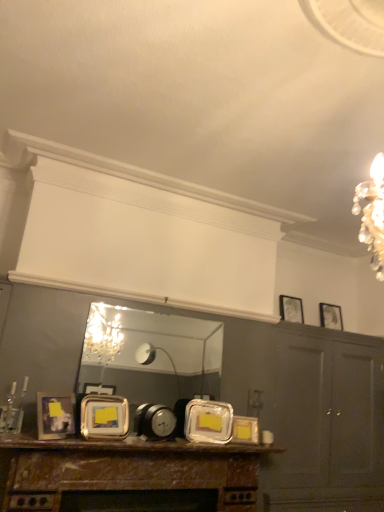
Identify the location of metallic silver alarm clock at center. (154, 421).

Consider the image. Measure the distance between metallic silver frame at center, which is the fourth picture frame in right-to-left order, and camera.

metallic silver frame at center, which is the fourth picture frame in right-to-left order, and camera are 2.44 meters apart from each other.

What are the coordinates of `matte silver picture frame at upper right, the fifth picture frame when ordered from left to right` in the screenshot? It's located at (330, 316).

Image resolution: width=384 pixels, height=512 pixels. What do you see at coordinates (330, 316) in the screenshot?
I see `matte silver picture frame at upper right, the first picture frame in the back-to-front sequence` at bounding box center [330, 316].

At what (x,y) coordinates should I click in order to perform the action: click on matte gray cabinet at right. Please return your answer as a coordinate pair (x, y). Image resolution: width=384 pixels, height=512 pixels. Looking at the image, I should click on (326, 421).

This screenshot has width=384, height=512. What do you see at coordinates (291, 309) in the screenshot? I see `metallic silver picture frame at upper right, which is the fourth picture frame in left-to-right order` at bounding box center [291, 309].

The image size is (384, 512). In order to click on matte silver picture frame at lower left, which ranks as the fifth picture frame in back-to-front order in this screenshot , I will do `click(55, 416)`.

Does point (329, 328) come farther from viewer compared to point (92, 450)?

Yes, it is behind point (92, 450).

What's the angular difference between matte silver picture frame at upper right, the fifth picture frame when ordered from left to right, and rustic wood mantel at lower center's facing directions?

1.96 degrees separate the facing orientations of matte silver picture frame at upper right, the fifth picture frame when ordered from left to right, and rustic wood mantel at lower center.

Considering the sizes of objects matte silver picture frame at upper right, marked as the 1th picture frame in a right-to-left arrangement, and rustic wood mantel at lower center in the image provided, who is taller, matte silver picture frame at upper right, marked as the 1th picture frame in a right-to-left arrangement, or rustic wood mantel at lower center?

rustic wood mantel at lower center is taller.

Between metallic silver picture frame at upper right, the second picture frame in the right-to-left sequence, and metallic silver frame at center, which appears as the fourth picture frame when viewed from the back, which one has larger size?

Bigger between the two is metallic silver frame at center, which appears as the fourth picture frame when viewed from the back.

Is metallic silver picture frame at upper right, which is the 4th picture frame in front-to-back order, spatially inside metallic silver frame at center, which is the fourth picture frame in right-to-left order, or outside of it?

metallic silver picture frame at upper right, which is the 4th picture frame in front-to-back order, is outside metallic silver frame at center, which is the fourth picture frame in right-to-left order.

From a real-world perspective, is metallic silver picture frame at upper right, the second picture frame in the back-to-front sequence, physically above metallic silver frame at center, acting as the 2th picture frame starting from the front?

Indeed, from a real-world perspective, metallic silver picture frame at upper right, the second picture frame in the back-to-front sequence, stands above metallic silver frame at center, acting as the 2th picture frame starting from the front.

Considering the points (291, 313) and (122, 398), which point is in front, point (291, 313) or point (122, 398)?

Point (122, 398)

Considering the relative sizes of metallic silver tray at center and metallic silver alarm clock at center in the image provided, is metallic silver tray at center wider than metallic silver alarm clock at center?

Yes, metallic silver tray at center is wider than metallic silver alarm clock at center.

Find the location of a particular element. The image size is (384, 512). counter top that is below the metallic silver alarm clock at center (from the image's perspective) is located at coordinates (132, 446).

Based on the photo, which is farther, (x=28, y=446) or (x=175, y=418)?

The point (x=175, y=418) is farther from the camera.

Does metallic silver tray at center turn towards metallic silver alarm clock at center?

No, metallic silver tray at center does not turn towards metallic silver alarm clock at center.

Is metallic silver picture frame at upper right, the second picture frame in the back-to-front sequence, oriented away from matte silver picture frame at lower left, the first picture frame viewed from the front?

metallic silver picture frame at upper right, the second picture frame in the back-to-front sequence, does not have its back to matte silver picture frame at lower left, the first picture frame viewed from the front.

At what (x,y) coordinates should I click in order to perform the action: click on the 3rd picture frame to the left when counting from the metallic silver picture frame at upper right, the second picture frame in the right-to-left sequence. Please return your answer as a coordinate pair (x, y). The image size is (384, 512). Looking at the image, I should click on (55, 416).

Can you confirm if metallic silver picture frame at upper right, which is the fourth picture frame in left-to-right order, is shorter than matte silver picture frame at lower left, which appears as the first picture frame when viewed from the left?

Incorrect, the height of metallic silver picture frame at upper right, which is the fourth picture frame in left-to-right order, does not fall short of that of matte silver picture frame at lower left, which appears as the first picture frame when viewed from the left.

In terms of size, does matte gray cabinet at right appear bigger or smaller than metallic reflective mirror at center?

In the image, matte gray cabinet at right appears to be larger than metallic reflective mirror at center.

Does point (348, 433) come in front of point (169, 398)?

That is False.

Does matte gray cabinet at right have a greater height compared to metallic reflective mirror at center?

Yes.

Is matte gray cabinet at right far away from metallic reflective mirror at center?

That's right, there is a large distance between matte gray cabinet at right and metallic reflective mirror at center.

Is matte silver picture frame at lower left, which appears as the first picture frame when viewed from the left, aimed at metallic silver picture frame at upper right, which is the fourth picture frame in left-to-right order?

No, matte silver picture frame at lower left, which appears as the first picture frame when viewed from the left, is not aimed at metallic silver picture frame at upper right, which is the fourth picture frame in left-to-right order.

You are a GUI agent. You are given a task and a screenshot of the screen. Output one action in this format:
    pyautogui.click(x=<x>, y=<y>)
    Task: Click on the 3rd picture frame in front of the metallic silver picture frame at upper right, which is the 4th picture frame in front-to-back order
    
    Given the screenshot: What is the action you would take?
    pyautogui.click(x=55, y=416)

Is point (57, 418) positioned in front of point (302, 318)?

Yes.

Between matte silver picture frame at lower left, which appears as the first picture frame when viewed from the left, and metallic silver picture frame at upper right, which is the 4th picture frame in front-to-back order, which one has less height?

matte silver picture frame at lower left, which appears as the first picture frame when viewed from the left, is shorter.

Could you tell me if matte silver picture frame at lower left, which appears as the first picture frame when viewed from the left, is facing metallic silver tray at center?

No, matte silver picture frame at lower left, which appears as the first picture frame when viewed from the left, is not turned towards metallic silver tray at center.

Which is in front, matte silver picture frame at lower left, which ranks as the fifth picture frame in back-to-front order, or metallic silver tray at center?

metallic silver tray at center.

From a real-world perspective, which is physically below, matte silver picture frame at lower left, which appears as the first picture frame when viewed from the left, or metallic silver tray at center?

From a 3D spatial view, metallic silver tray at center is below.

I want to click on picture frame that is the 5th object located behind the rustic wood mantel at lower center, so click(x=330, y=316).

The height and width of the screenshot is (512, 384). In order to click on the 2nd picture frame in front when counting from the metallic silver picture frame at upper right, which is the 4th picture frame in front-to-back order in this screenshot , I will do `click(104, 417)`.

Estimate the real-world distances between objects in this image. Which object is closer to metallic silver frame at center, which is the fourth picture frame in right-to-left order, matte gray cabinet at right or metallic gold picture frame at center, which is the 3th picture frame from back to front?

Among the two, metallic gold picture frame at center, which is the 3th picture frame from back to front, is located nearer to metallic silver frame at center, which is the fourth picture frame in right-to-left order.

Considering their positions, is metallic silver tray at center positioned further to matte gray cabinet at right than metallic reflective mirror at center?

metallic reflective mirror at center is positioned further to the anchor matte gray cabinet at right.

Which object lies nearer to the anchor point metallic reflective mirror at center, metallic silver alarm clock at center or metallic silver picture frame at upper right, the second picture frame in the right-to-left sequence?

metallic silver alarm clock at center.

When comparing their distances from metallic silver picture frame at upper right, which is the fourth picture frame in left-to-right order, does metallic silver alarm clock at center or metallic silver tray at center seem further?

metallic silver tray at center.

Consider the image. Considering their positions, is rustic wood mantel at lower center positioned closer to metallic silver alarm clock at center than metallic silver frame at center, which appears as the fourth picture frame when viewed from the back?

Among the two, metallic silver frame at center, which appears as the fourth picture frame when viewed from the back, is located nearer to metallic silver alarm clock at center.

Considering their positions, is metallic gold picture frame at center, the 3th picture frame when ordered from front to back, positioned further to metallic silver picture frame at upper right, the second picture frame in the back-to-front sequence, than metallic reflective mirror at center?

metallic reflective mirror at center.

Which object lies nearer to the anchor point matte silver picture frame at lower left, which ranks as the fifth picture frame in back-to-front order, rustic wood mantel at lower center or metallic reflective mirror at center?

rustic wood mantel at lower center is positioned closer to the anchor matte silver picture frame at lower left, which ranks as the fifth picture frame in back-to-front order.

From the image, which object appears to be farther from metallic gold picture frame at center, the 3th picture frame when ordered from front to back, metallic silver alarm clock at center or metallic silver picture frame at upper right, which is the 4th picture frame in front-to-back order?

The object further to metallic gold picture frame at center, the 3th picture frame when ordered from front to back, is metallic silver picture frame at upper right, which is the 4th picture frame in front-to-back order.

Identify the location of alarm clock between matte silver picture frame at lower left, which ranks as the 5th picture frame in right-to-left order, and rustic wood mantel at lower center from top to bottom. The width and height of the screenshot is (384, 512). (154, 421).

Image resolution: width=384 pixels, height=512 pixels. Find the location of `cabinetry between rustic wood mantel at lower center and metallic silver picture frame at upper right, the second picture frame in the right-to-left sequence, along the z-axis`. cabinetry between rustic wood mantel at lower center and metallic silver picture frame at upper right, the second picture frame in the right-to-left sequence, along the z-axis is located at coordinates (326, 421).

The width and height of the screenshot is (384, 512). In order to click on mirror between metallic silver frame at center, which is the fourth picture frame in right-to-left order, and metallic silver alarm clock at center from left to right in this screenshot , I will do pos(149,356).

The image size is (384, 512). I want to click on mirror located between matte silver picture frame at lower left, which ranks as the fifth picture frame in back-to-front order, and metallic silver tray at center in the left-right direction, so click(x=149, y=356).